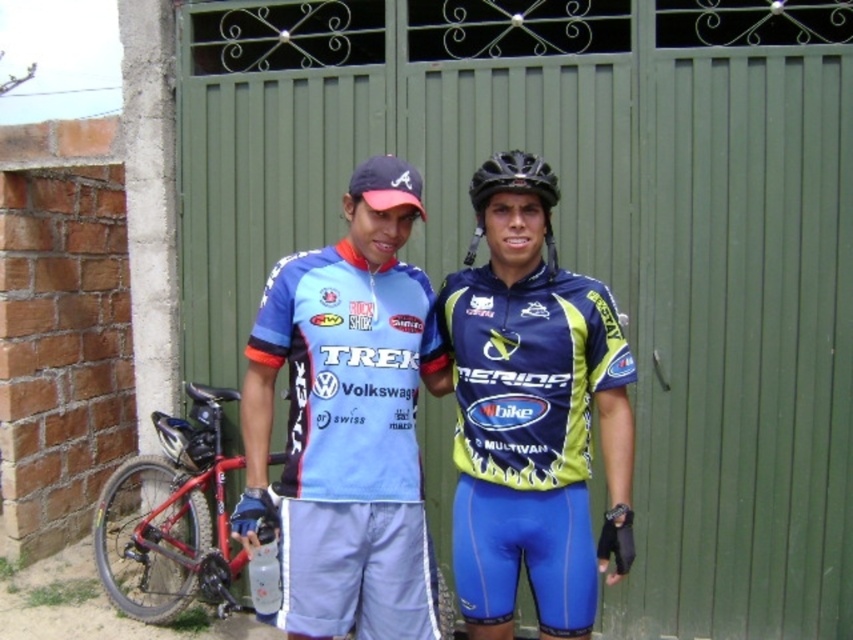
Question: Which point appears farthest from the camera in this image?

Choices:
 (A) (393, 627)
 (B) (463, 513)
 (C) (479, 172)

Answer: (B)

Question: Can you confirm if red matte bicycle at lower left is wider than black matte bicycle helmet at center?

Choices:
 (A) no
 (B) yes

Answer: (B)

Question: Can you confirm if blue jersey at center is wider than black matte bicycle helmet at center?

Choices:
 (A) yes
 (B) no

Answer: (A)

Question: Which point is closer to the camera?

Choices:
 (A) (502, 576)
 (B) (171, 576)

Answer: (A)

Question: Does blue jersey at center lie in front of blue/neon green jersey at center?

Choices:
 (A) no
 (B) yes

Answer: (B)

Question: Which point is farther to the camera?

Choices:
 (A) blue jersey at center
 (B) red matte bicycle at lower left
 (C) black matte bicycle helmet at center

Answer: (B)